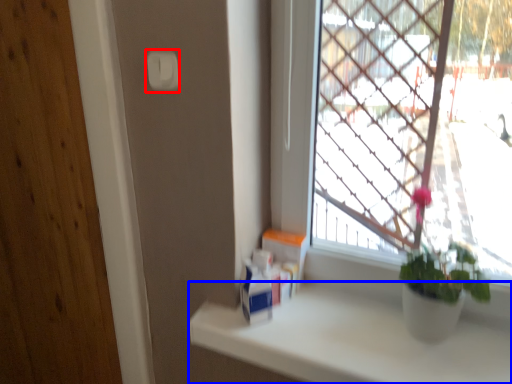
Question: Which point is further to the camera, light switch (highlighted by a red box) or counter top (highlighted by a blue box)?

Choices:
 (A) light switch
 (B) counter top

Answer: (A)